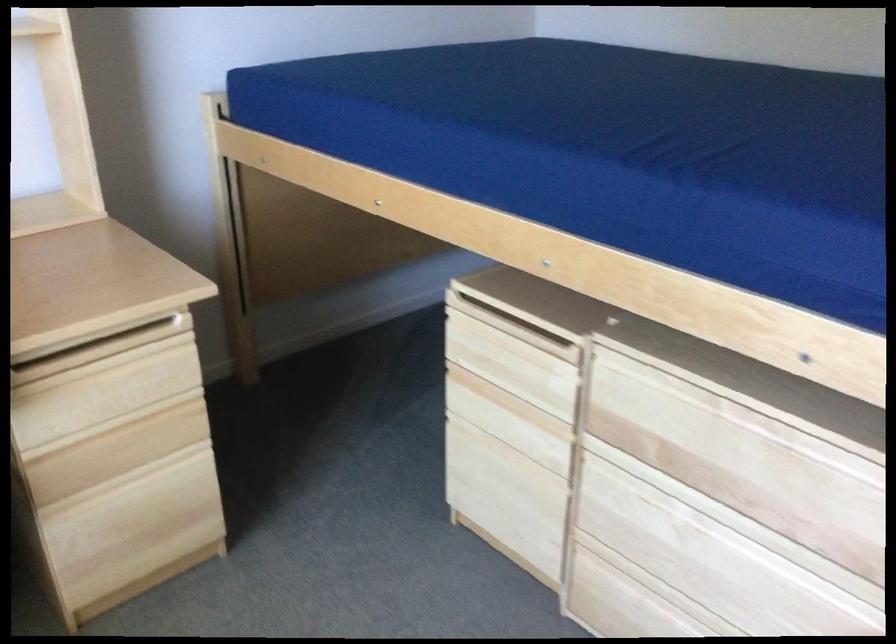
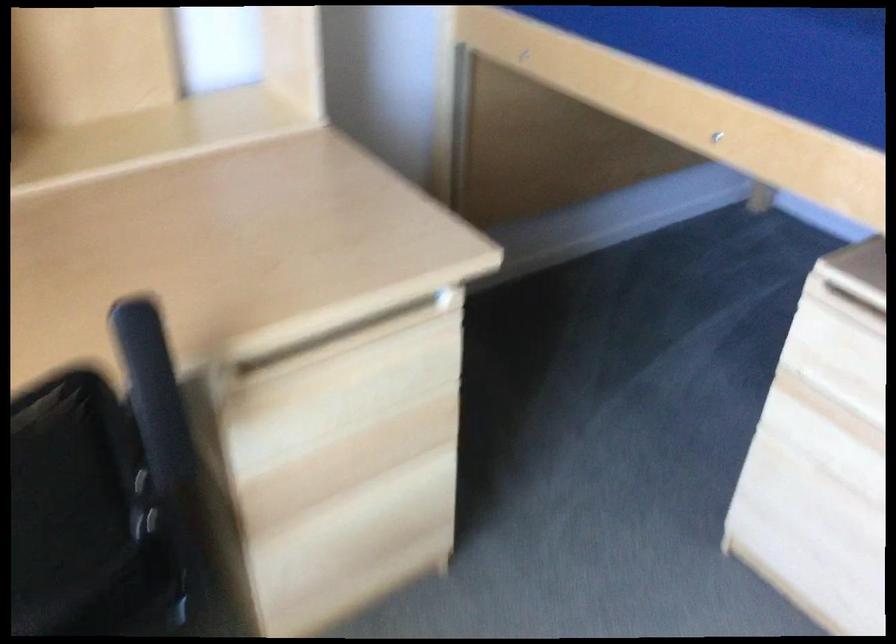
Question: The images are taken continuously from a first-person perspective. In which direction is your viewpoint rotating?

Choices:
 (A) Left
 (B) Right
 (C) Up
 (D) Down

Answer: (D)